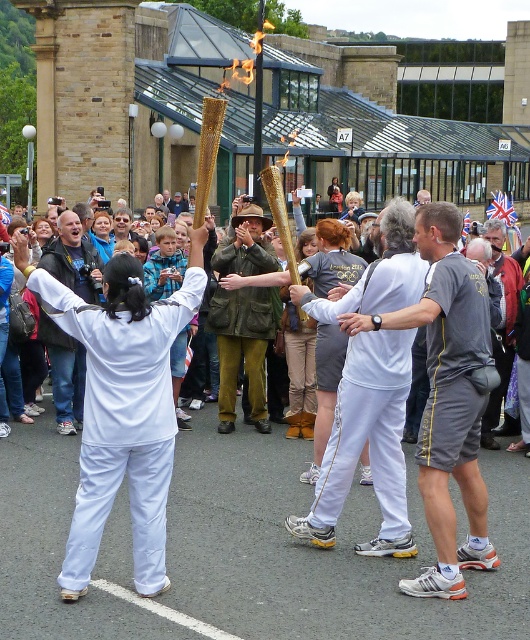
Is white cotton t-shirt at center further to camera compared to green corduroy jacket at center?

No, it is in front of green corduroy jacket at center.

Measure the distance from white cotton t-shirt at center to green corduroy jacket at center.

white cotton t-shirt at center and green corduroy jacket at center are 4.22 meters apart.

At what (x,y) coordinates should I click in order to perform the action: click on white cotton t-shirt at center. Please return your answer as a coordinate pair (x, y). Image resolution: width=530 pixels, height=640 pixels. Looking at the image, I should click on (368, 444).

Does gold metallic torch at center appear on the left side of white cloth at center?

In fact, gold metallic torch at center is to the right of white cloth at center.

Does point (472, 506) lie in front of point (89, 278)?

Yes, point (472, 506) is in front of point (89, 278).

Who is more distant from viewer, (403, 221) or (58, 328)?

Positioned behind is point (58, 328).

The width and height of the screenshot is (530, 640). Find the location of `gold metallic torch at center`. gold metallic torch at center is located at coordinates (110, 385).

Which of these two, gold metallic torch at center or white cotton t-shirt at center, stands shorter?

white cotton t-shirt at center

Between point (102, 381) and point (343, 412), which one is positioned in front?

Point (102, 381) is in front.

Image resolution: width=530 pixels, height=640 pixels. In order to click on gold metallic torch at center in this screenshot , I will do `click(110, 385)`.